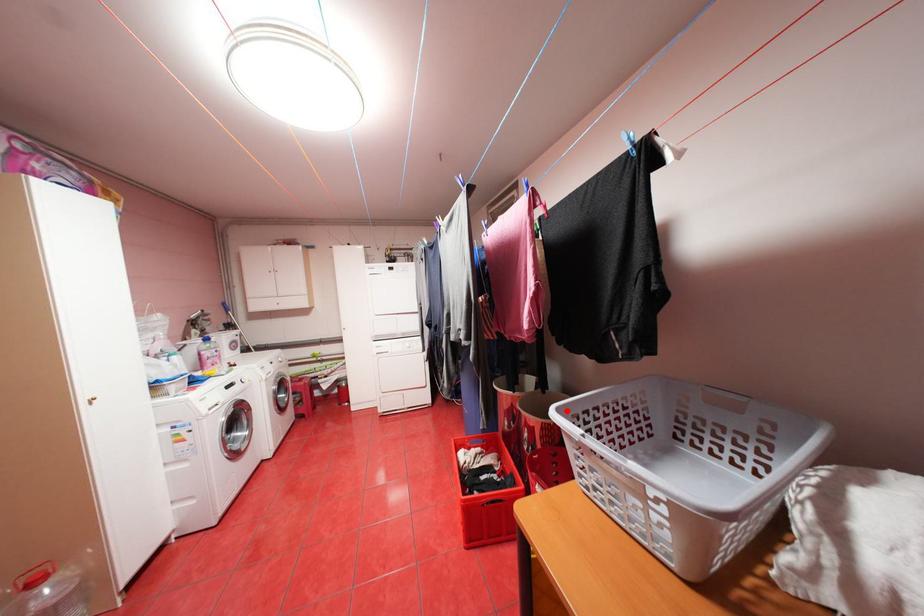
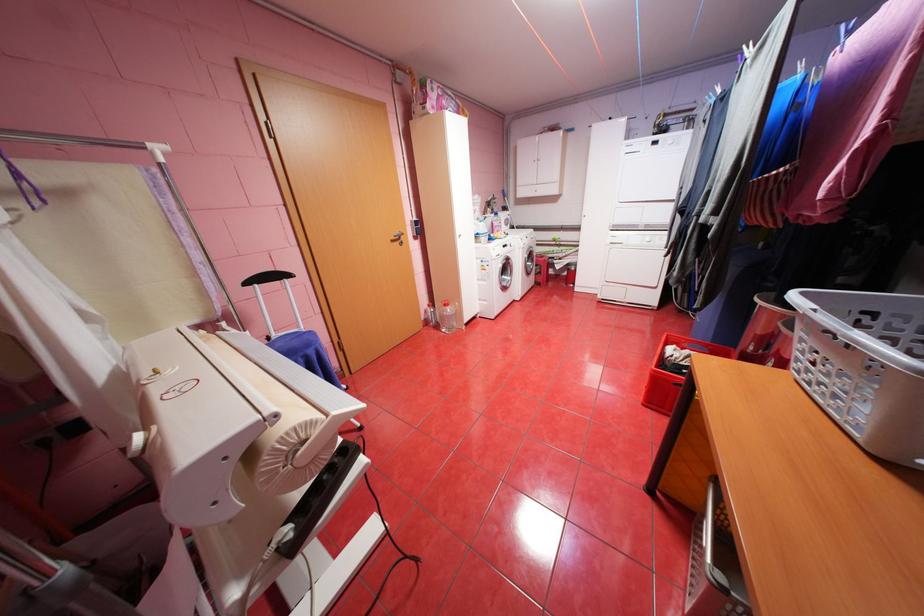
Question: I am providing you with two images of the same scene from different viewpoints. In image1, a red point is highlighted. Considering the same 3D point in image2, which of the following is correct?

Choices:
 (A) It is closer
 (B) It is farther

Answer: (B)